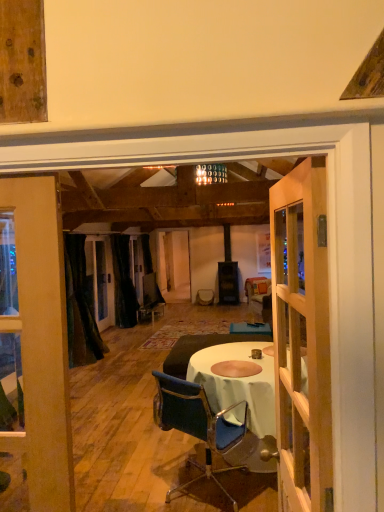
Where is `vacant area situated to the left side of blue fabric chair at center`? The height and width of the screenshot is (512, 384). vacant area situated to the left side of blue fabric chair at center is located at coordinates (130, 480).